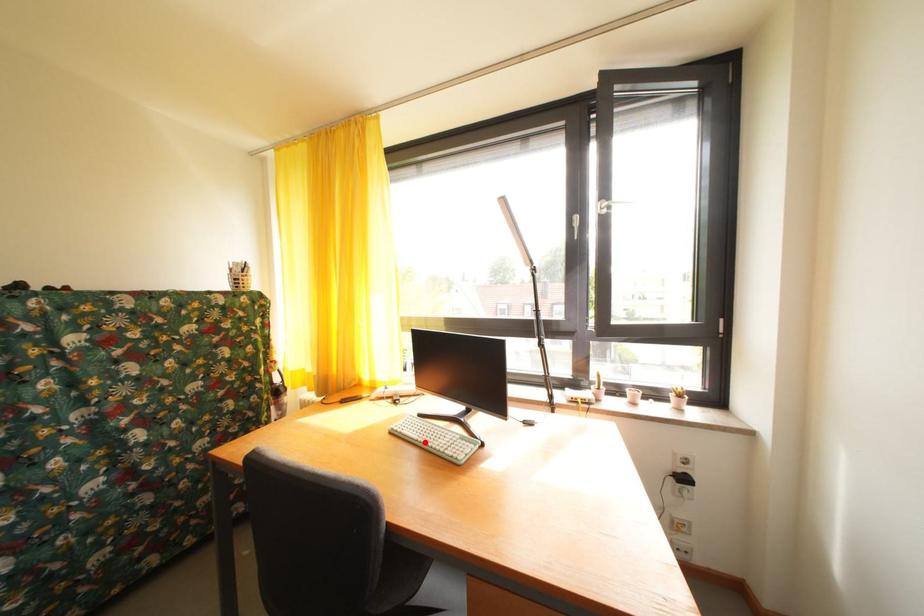
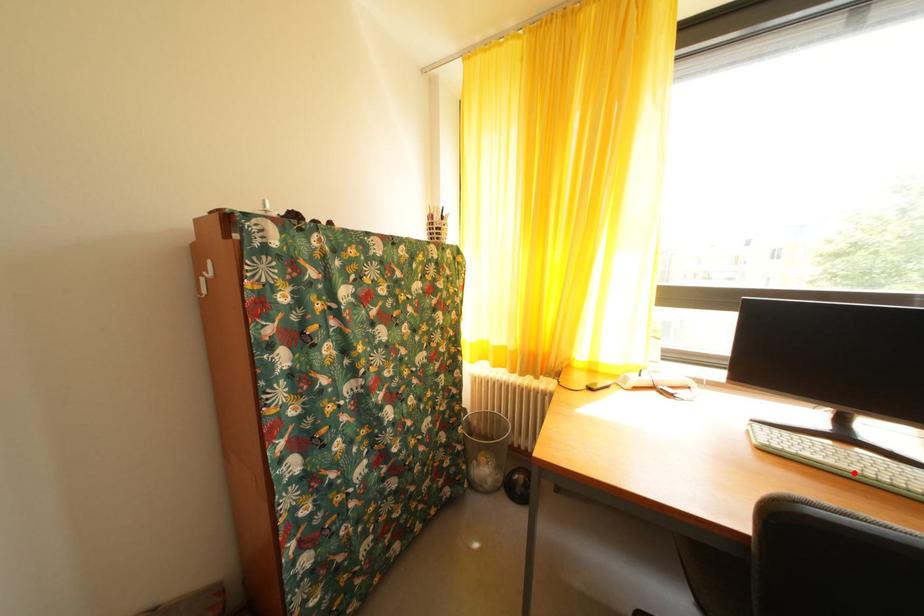
I am providing you with two images of the same scene from different viewpoints. A red point is marked on the first image and another point is marked on the second image. Do the highlighted points in image1 and image2 indicate the same real-world spot?

Yes